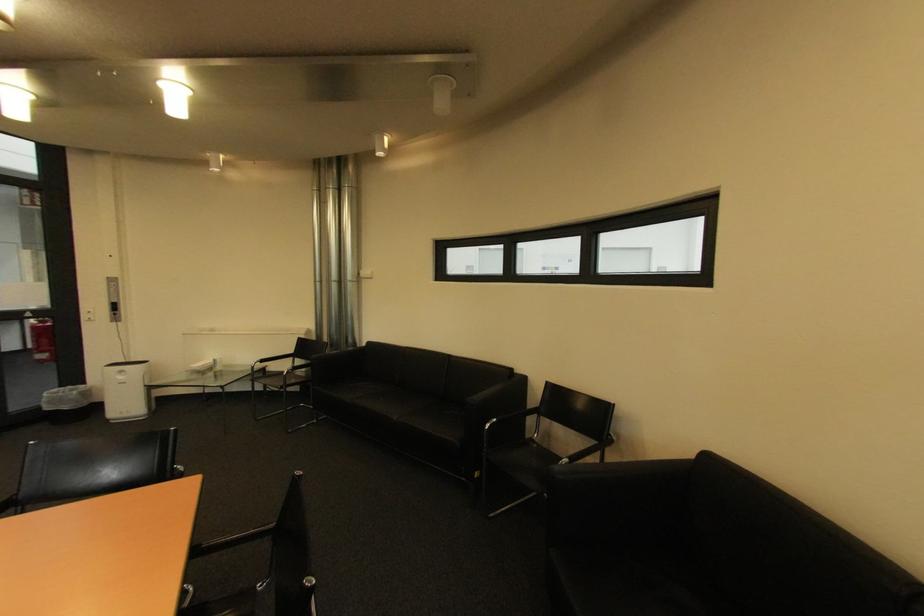
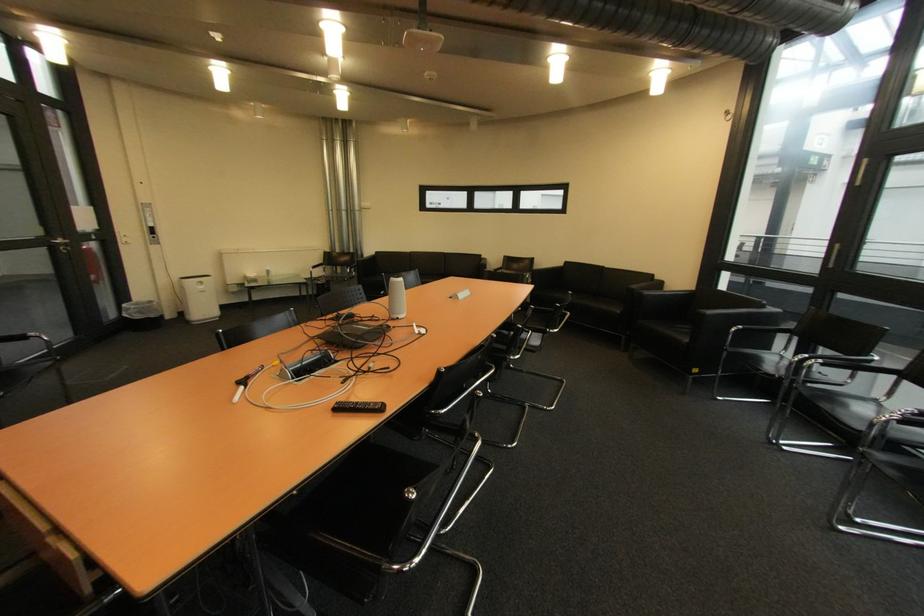
Find the pixel in the second image that matches the point at 129,379 in the first image.

(209, 288)